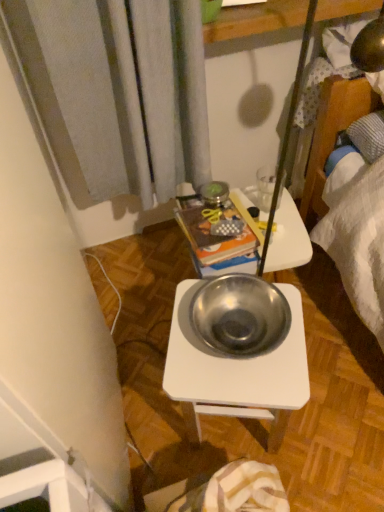
Identify the location of free space above metallic white desk at center (from a real-world perspective). (243, 334).